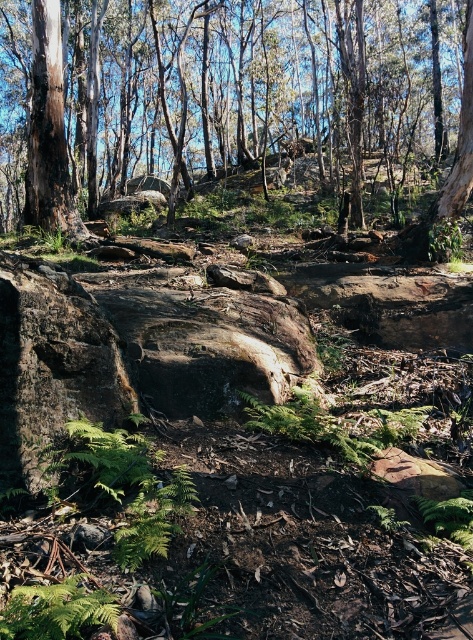
Which is in front, point (425, 20) or point (387, 417)?

Point (387, 417) is in front.

Is point (15, 140) closer to viewer compared to point (306, 401)?

No, it is behind (306, 401).

Where is `brown rough tree at center`? This screenshot has height=640, width=473. brown rough tree at center is located at coordinates (256, 84).

Is brown rough tree at center above green leafy fern at lower left?

Yes, brown rough tree at center is above green leafy fern at lower left.

Is brown rough tree at center below green leafy fern at lower left?

Incorrect, brown rough tree at center is not positioned below green leafy fern at lower left.

Locate an element on the screen. brown rough tree at center is located at coordinates (256, 84).

Looking at this image, between green matte fern at center and green leafy fern at lower left, which one is positioned higher?

green matte fern at center

Is point (247, 426) closer to camera compared to point (102, 602)?

That is False.

You are a GUI agent. You are given a task and a screenshot of the screen. Output one action in this format:
    pyautogui.click(x=<x>, y=<y>)
    Task: Click on the green matte fern at center
    The image size is (473, 640).
    Given the screenshot: What is the action you would take?
    pyautogui.click(x=330, y=426)

Locate an element on the screen. This screenshot has width=473, height=640. green matte fern at center is located at coordinates (330, 426).